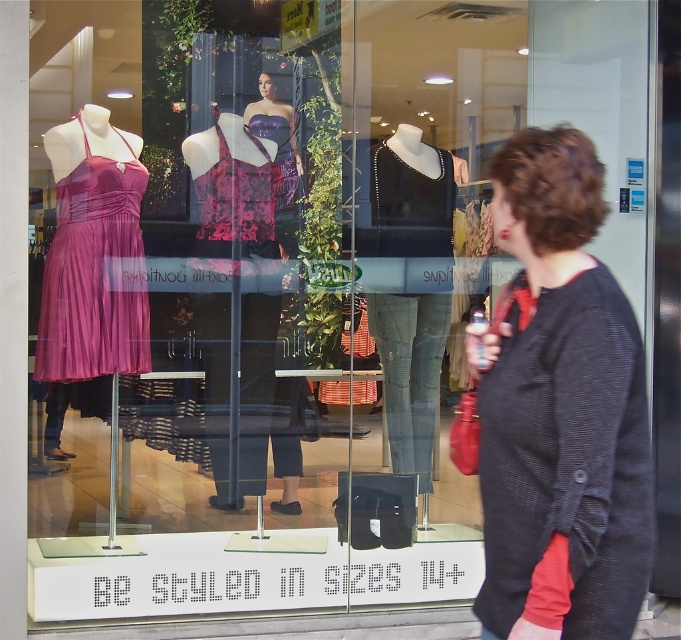
Question: Which of the following is the farthest from the observer?

Choices:
 (A) black textured sweater at center
 (B) matte purple dress at center

Answer: (B)

Question: Can you confirm if black textured sweater at center is smaller than purple pleated dress at left?

Choices:
 (A) no
 (B) yes

Answer: (A)

Question: Which object appears closest to the camera in this image?

Choices:
 (A) black textured sweater at center
 (B) matte purple dress at center
 (C) purple pleated dress at left

Answer: (A)

Question: In this image, where is matte purple dress at center located relative to purple pleated dress at left?

Choices:
 (A) above
 (B) below

Answer: (B)

Question: Does black textured sweater at center have a greater width compared to purple pleated dress at left?

Choices:
 (A) yes
 (B) no

Answer: (B)

Question: Which point is farther from the camera taking this photo?

Choices:
 (A) (244, 136)
 (B) (520, 250)
 (C) (121, 188)

Answer: (A)